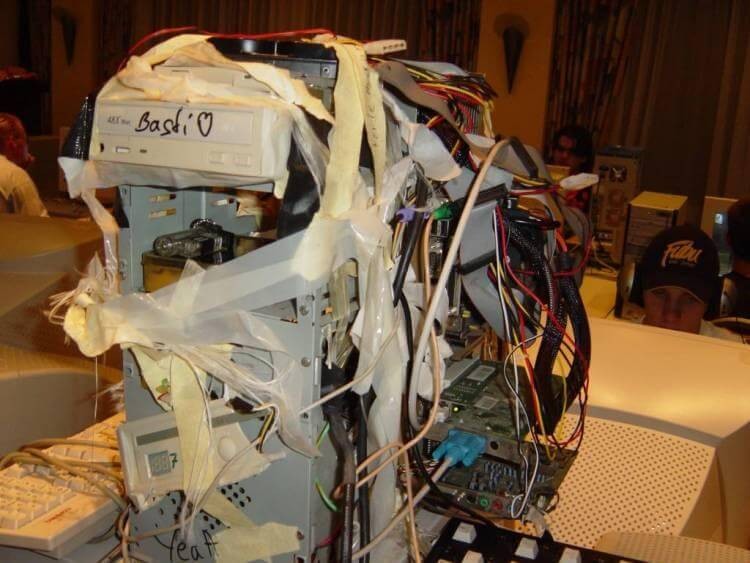
This screenshot has height=563, width=750. I want to click on plug, so click(460, 445).